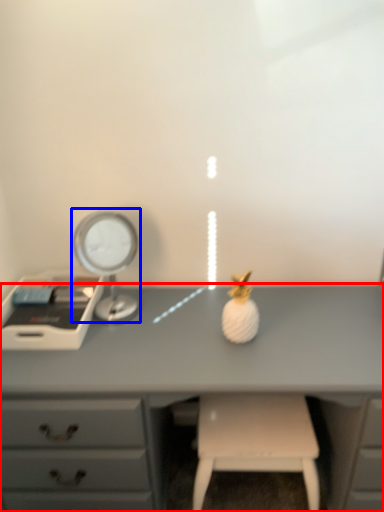
Question: Which object appears closest to the camera in this image, desk (highlighted by a red box) or bedside lamp (highlighted by a blue box)?

Choices:
 (A) desk
 (B) bedside lamp

Answer: (A)